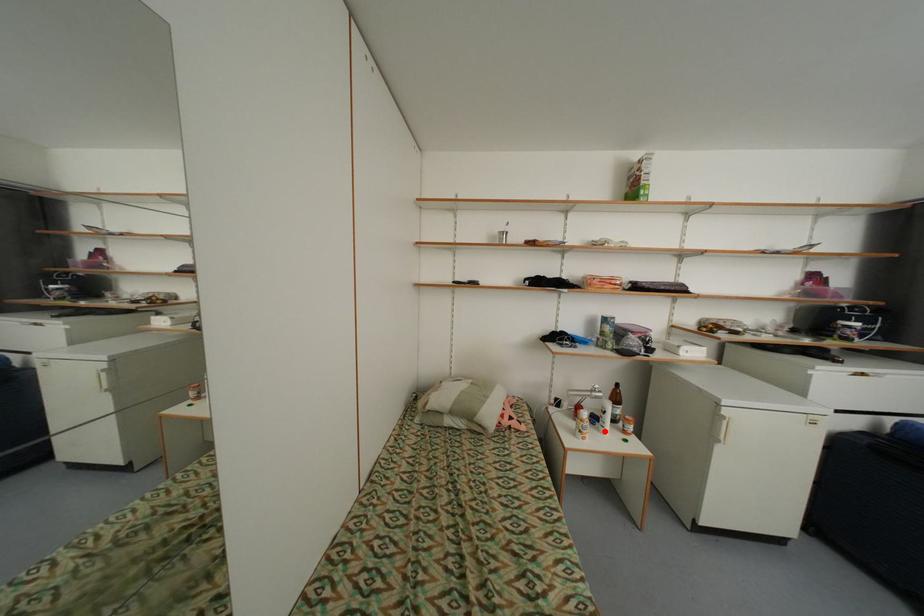
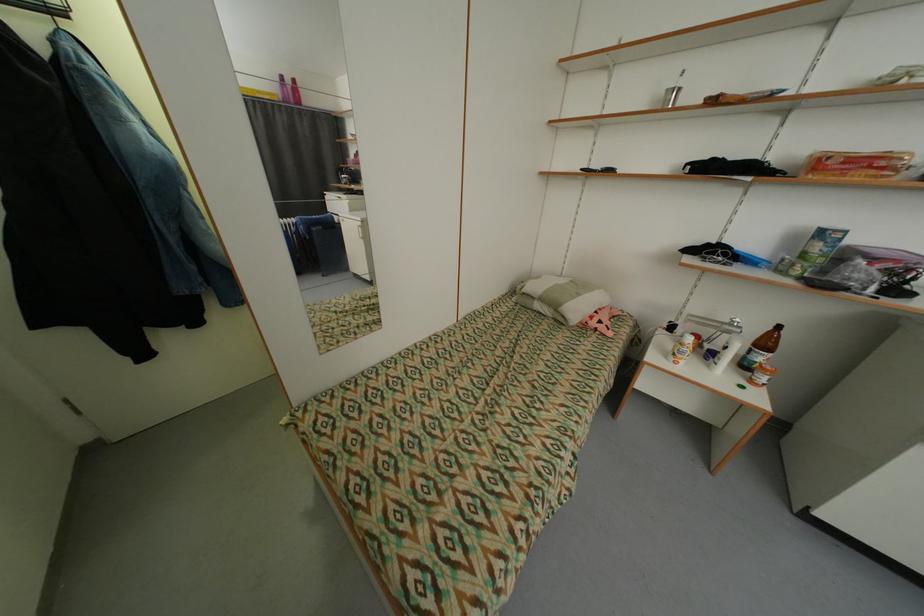
Question: I am providing you with two images of the same scene from different viewpoints. Image1 has a red point marked. In image2, the corresponding 3D location appears at what relative position? Reply with the corresponding letter.

Choices:
 (A) Closer
 (B) Farther

Answer: (A)